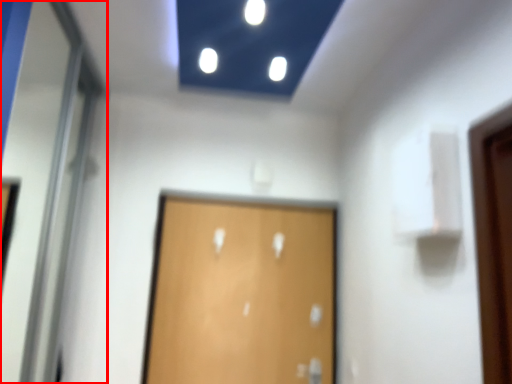
Question: From the image's perspective, considering the relative positions of elevator door (annotated by the red box) and door in the image provided, where is elevator door (annotated by the red box) located with respect to the staircase?

Choices:
 (A) above
 (B) below

Answer: (A)